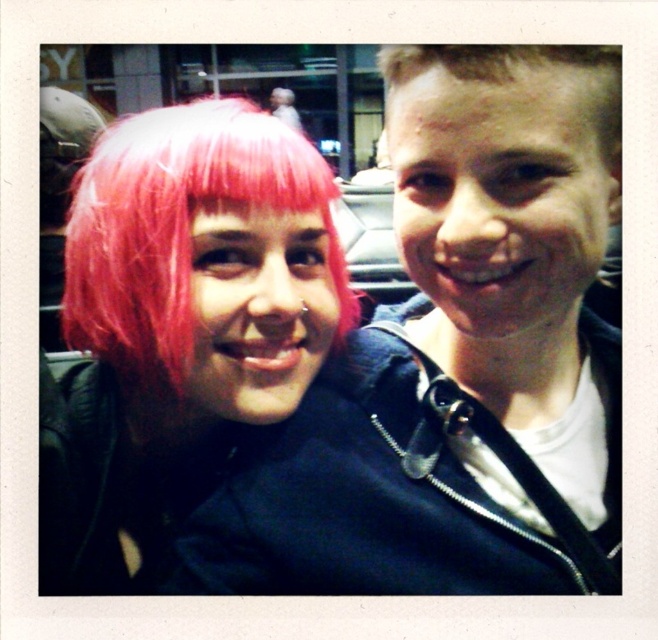
Question: Can you confirm if pink matte hair at center is bigger than pink matte wig at left?

Choices:
 (A) no
 (B) yes

Answer: (A)

Question: Which is farther from the blonde hair at upper right?

Choices:
 (A) pink matte wig at left
 (B) pink matte hair at center

Answer: (A)

Question: Which object appears farthest from the camera in this image?

Choices:
 (A) pink matte wig at left
 (B) blonde hair at upper right

Answer: (A)

Question: In this image, where is pink matte hair at center located relative to blonde hair at upper right?

Choices:
 (A) above
 (B) below

Answer: (B)

Question: Can you confirm if pink matte wig at left is smaller than blonde hair at upper right?

Choices:
 (A) yes
 (B) no

Answer: (B)

Question: Which point is closer to the camera?

Choices:
 (A) (307, 540)
 (B) (447, 72)
 (C) (295, 208)

Answer: (B)